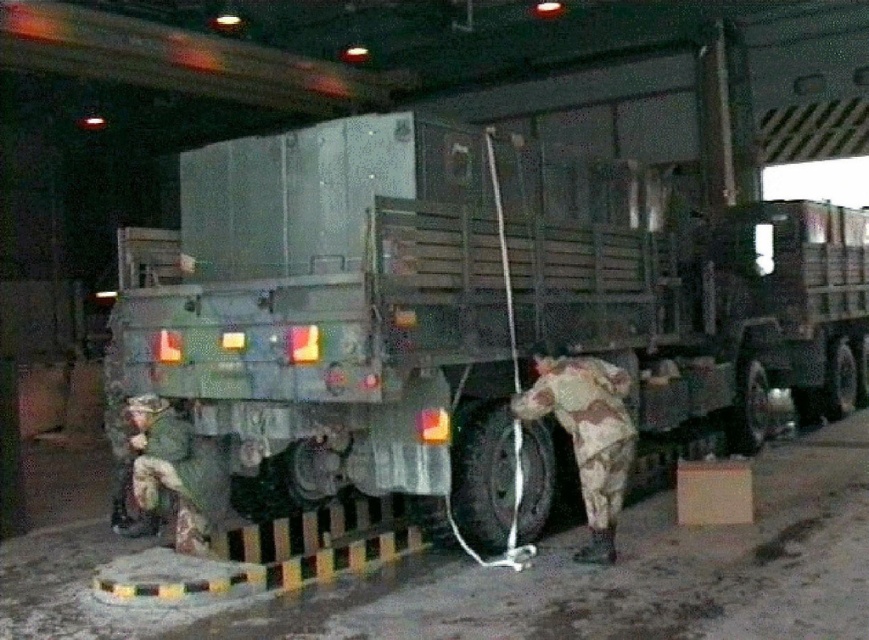
Question: Which point is closer to the camera taking this photo?

Choices:
 (A) [203, 529]
 (B) [539, 362]
 (C) [511, 420]

Answer: (B)

Question: Is green matte trailer truck at center bigger than camouflage fabric soldier at lower right?

Choices:
 (A) yes
 (B) no

Answer: (A)

Question: Is green matte trailer truck at center in front of camouflage fabric soldier at lower left?

Choices:
 (A) yes
 (B) no

Answer: (A)

Question: Is camouflage fabric soldier at lower right smaller than camouflage fabric soldier at lower left?

Choices:
 (A) yes
 (B) no

Answer: (B)

Question: Which point appears closest to the camera in this image?

Choices:
 (A) (576, 372)
 (B) (486, 538)

Answer: (A)

Question: Considering the real-world distances, which object is farthest from the camouflage fabric soldier at lower left?

Choices:
 (A) green matte trailer truck at center
 (B) camouflage fabric soldier at lower right

Answer: (A)